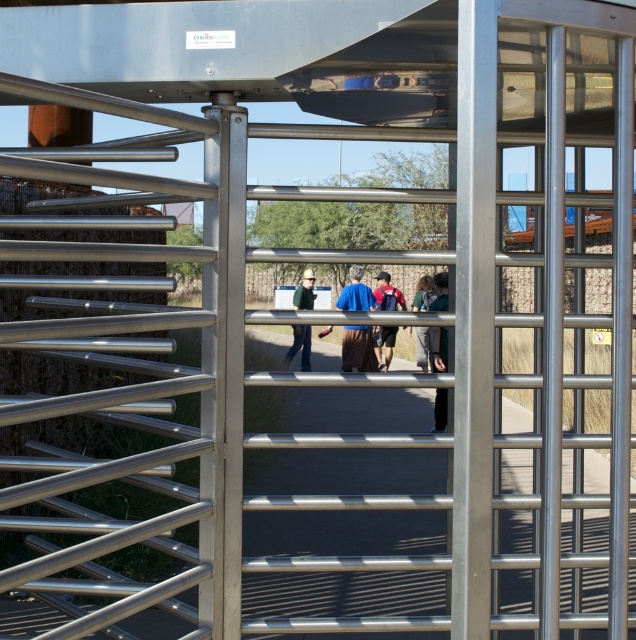
Between metallic gray path at center and transparent glass door at center, which one has more height?

With more height is transparent glass door at center.

Does point (343, 545) come closer to viewer compared to point (370, 458)?

Yes, point (343, 545) is closer to viewer.

Where is `metallic gray path at center`? metallic gray path at center is located at coordinates (343, 532).

Is metallic gray path at center smaller than matte blue backpack at center?

No, metallic gray path at center is not smaller than matte blue backpack at center.

Does point (329, 528) come in front of point (382, 294)?

Yes, it is.

The height and width of the screenshot is (640, 636). Identify the location of metallic gray path at center. coord(343,532).

Does brown fabric at center appear over matte blue backpack at center?

Incorrect, brown fabric at center is not positioned above matte blue backpack at center.

Between point (361, 307) and point (403, 305), which one is positioned in front?

Positioned in front is point (361, 307).

Between point (342, 348) and point (384, 280), which one is positioned behind?

Point (384, 280)

Where is `brown fabric at center`? The image size is (636, 640). brown fabric at center is located at coordinates (357, 348).